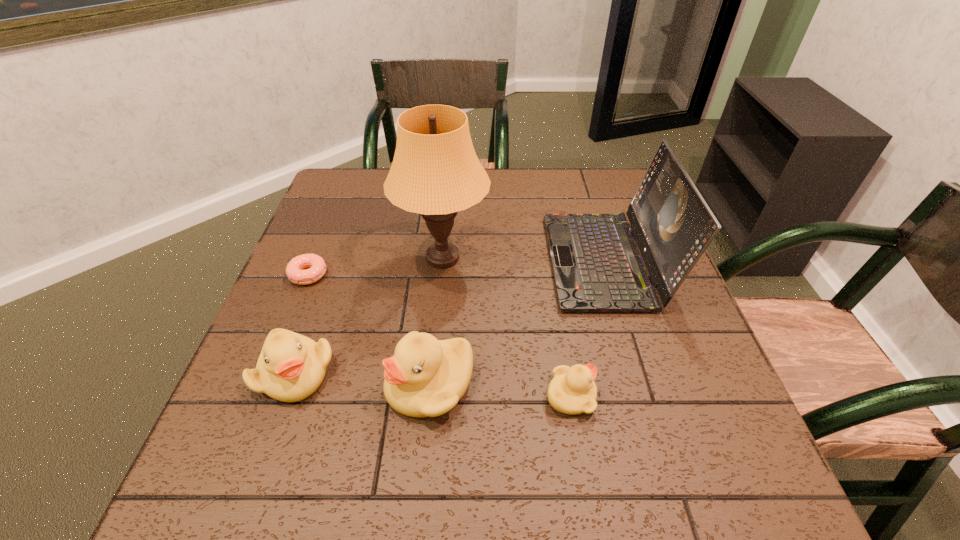
In order to click on free space located 0.100m on the front-facing side of the second duckling from right to left in this screenshot , I will do `click(334, 384)`.

Image resolution: width=960 pixels, height=540 pixels. I want to click on free space located on the front-facing side of the shortest duckling, so (639, 396).

Where is `vacant area situated 0.200m on the back of the lampshade`? Image resolution: width=960 pixels, height=540 pixels. vacant area situated 0.200m on the back of the lampshade is located at coordinates (449, 188).

Locate an element on the screen. This screenshot has height=540, width=960. vacant space located on the screen of the second tallest object is located at coordinates coord(517,261).

Identify the location of vacant space located on the screen of the second tallest object. (417, 261).

What are the coordinates of `free space located on the screen of the second tallest object` in the screenshot? It's located at (514, 261).

You are a GUI agent. You are given a task and a screenshot of the screen. Output one action in this format:
    pyautogui.click(x=<x>, y=<y>)
    Task: Click on the vacant space located on the right of the doughnut
    The width and height of the screenshot is (960, 540).
    Given the screenshot: What is the action you would take?
    pyautogui.click(x=444, y=274)

Locate an element on the screen. The image size is (960, 540). duckling located in the left edge section of the desktop is located at coordinates (291, 367).

Locate an element on the screen. The height and width of the screenshot is (540, 960). doughnut situated at the left edge is located at coordinates click(317, 267).

The width and height of the screenshot is (960, 540). I want to click on object at the right edge, so click(597, 267).